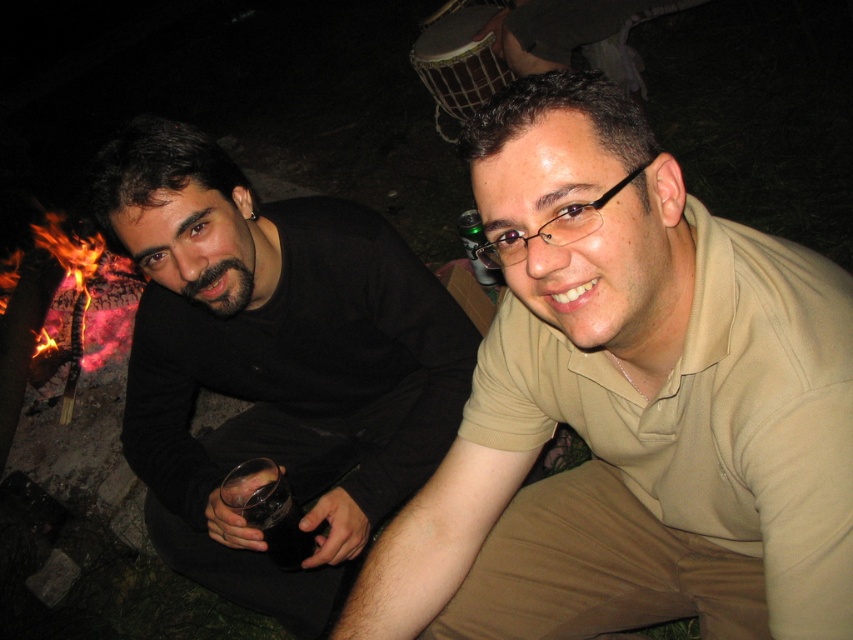
Question: Can you confirm if beige cotton shirt at center is positioned to the right of dark glass at lower left?

Choices:
 (A) no
 (B) yes

Answer: (B)

Question: Is beige cotton shirt at center positioned at the back of translucent glass at center?

Choices:
 (A) yes
 (B) no

Answer: (B)

Question: Which point is closer to the camera taking this photo?

Choices:
 (A) (288, 518)
 (B) (468, 246)

Answer: (A)

Question: Which of the following is the farthest from the observer?

Choices:
 (A) translucent glass at center
 (B) black matte shirt at left
 (C) beige cotton shirt at center

Answer: (A)

Question: Is beige cotton shirt at center further to camera compared to black matte shirt at left?

Choices:
 (A) yes
 (B) no

Answer: (B)

Question: Which object is the closest to the translucent glass at center?

Choices:
 (A) dark glass at lower left
 (B) beige cotton shirt at center

Answer: (A)